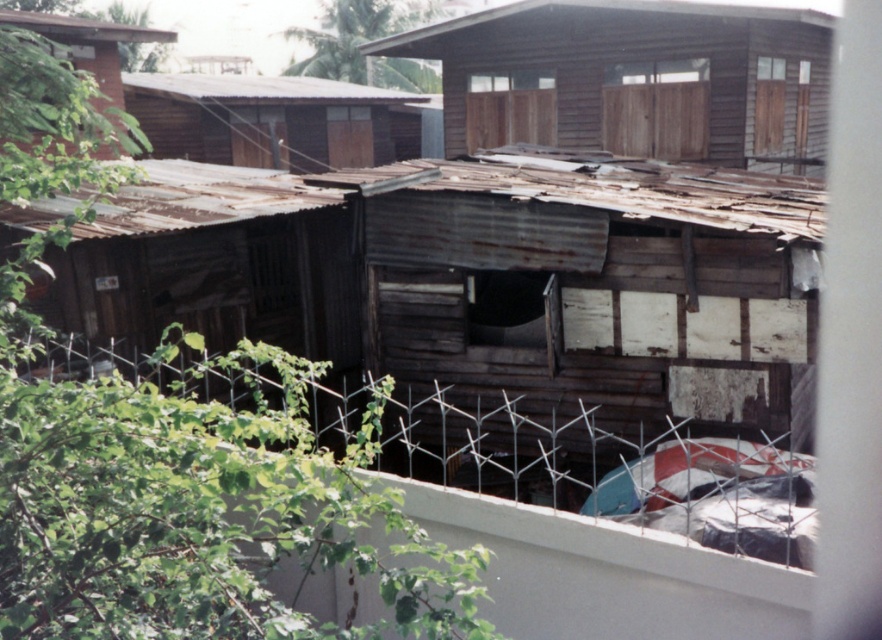
You are standing in front of the white concrete wall with a metal fence. There is a metallic wire mesh at lower center. Where is the metallic wire mesh positioned relative to the white concrete wall?

The metallic wire mesh at lower center is located at point (510, 449) relative to the white concrete wall.

You are a delivery person trying to deliver a package to the rusty corrugated metal hut at left. You notice there is a metallic wire mesh at lower center in your path. Can you walk over it to reach the hut?

The metallic wire mesh at lower center is shorter than the rusty corrugated metal hut at left, so yes, you can walk over the metallic wire mesh at lower center to reach the rusty corrugated metal hut at left since it is lower in height.

You are a delivery person trying to navigate through the narrow alley between the rusty corrugated metal hut at left and the brown corrugated metal hut at upper left. Which direction should you go to avoid hitting your head?

The rusty corrugated metal hut at left is positioned under the brown corrugated metal hut at upper left, so you should go under the rusty corrugated metal hut at left to avoid hitting your head.